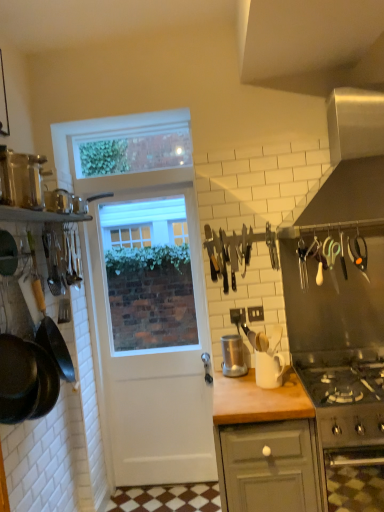
Question: Is black matte frying pan at left to the left of metallic stainless steel blender at center, arranged as the second kitchen appliance when viewed from the left, from the viewer's perspective?

Choices:
 (A) yes
 (B) no

Answer: (A)

Question: Can you confirm if black matte frying pan at left is bigger than metallic stainless steel blender at center, arranged as the second kitchen appliance when viewed from the left?

Choices:
 (A) yes
 (B) no

Answer: (A)

Question: Is black matte frying pan at left facing towards metallic stainless steel blender at center, which is counted as the 2th kitchen appliance, starting from the top?

Choices:
 (A) no
 (B) yes

Answer: (A)

Question: Does black matte frying pan at left have a lesser width compared to metallic stainless steel blender at center, positioned as the 2th kitchen appliance in bottom-to-top order?

Choices:
 (A) yes
 (B) no

Answer: (B)

Question: From a real-world perspective, is black matte frying pan at left positioned over metallic stainless steel blender at center, which is counted as the 2th kitchen appliance, starting from the top, based on gravity?

Choices:
 (A) yes
 (B) no

Answer: (A)

Question: Visually, is metallic stainless steel blender at center, the first kitchen appliance viewed from the back, positioned to the left or to the right of clear plastic window screen at upper center?

Choices:
 (A) left
 (B) right

Answer: (B)

Question: Looking at their shapes, would you say metallic stainless steel blender at center, which is counted as the 2th kitchen appliance, starting from the top, is wider or thinner than clear plastic window screen at upper center?

Choices:
 (A) wide
 (B) thin

Answer: (A)

Question: Relative to clear plastic window screen at upper center, is metallic stainless steel blender at center, the 3th kitchen appliance when ordered from front to back, in front or behind?

Choices:
 (A) front
 (B) behind

Answer: (A)

Question: Considering the positions of metallic stainless steel blender at center, arranged as the 2th kitchen appliance when viewed from the right, and clear plastic window screen at upper center in the image, is metallic stainless steel blender at center, arranged as the 2th kitchen appliance when viewed from the right, taller or shorter than clear plastic window screen at upper center?

Choices:
 (A) short
 (B) tall

Answer: (A)

Question: Is satin silver exhaust hood at upper right to the left or to the right of stainless steel oven at lower right in the image?

Choices:
 (A) right
 (B) left

Answer: (B)

Question: Looking at the image, does satin silver exhaust hood at upper right seem bigger or smaller compared to stainless steel oven at lower right?

Choices:
 (A) big
 (B) small

Answer: (A)

Question: Is satin silver exhaust hood at upper right spatially inside stainless steel oven at lower right, or outside of it?

Choices:
 (A) outside
 (B) inside

Answer: (A)

Question: From the image's perspective, is satin silver exhaust hood at upper right positioned above or below stainless steel oven at lower right?

Choices:
 (A) above
 (B) below

Answer: (A)

Question: Looking at their shapes, would you say metallic silver canisters at upper left, which is the 1th kitchen appliance in left-to-right order, is wider or thinner than stainless steel oven at lower right?

Choices:
 (A) wide
 (B) thin

Answer: (B)

Question: Would you say metallic silver canisters at upper left, which is the 1th kitchen appliance in left-to-right order, is to the left or to the right of stainless steel oven at lower right in the picture?

Choices:
 (A) right
 (B) left

Answer: (B)